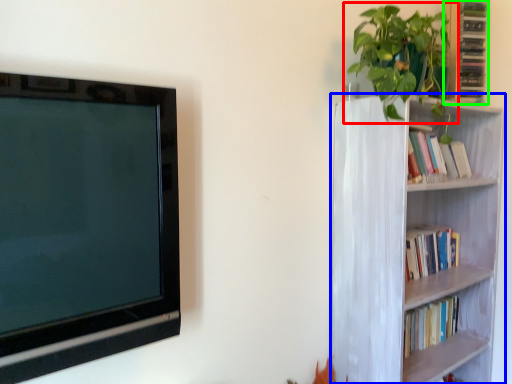
Question: Which object is the farthest from houseplant (highlighted by a red box)? Choose among these: bookcase (highlighted by a blue box) or cabinet (highlighted by a green box).

Choices:
 (A) bookcase
 (B) cabinet

Answer: (A)